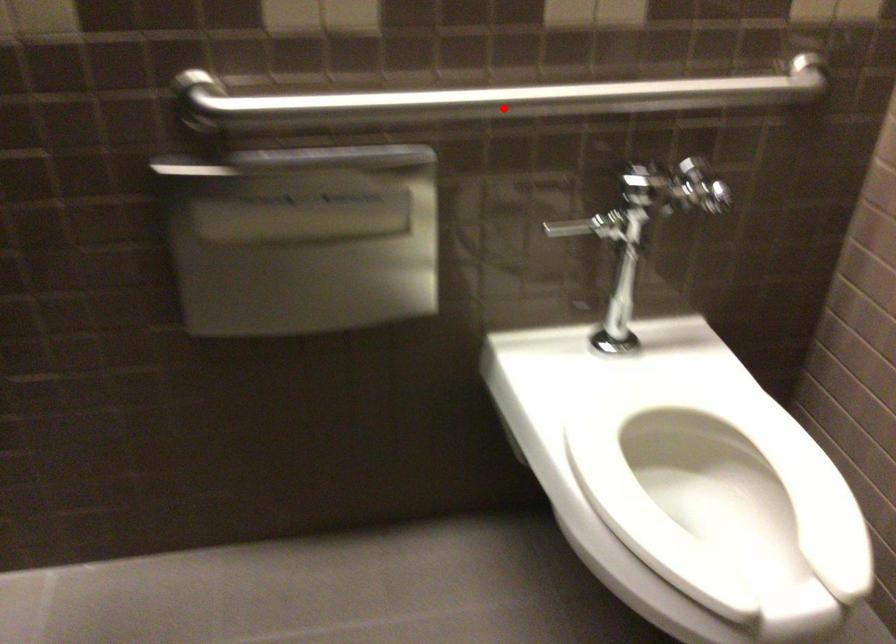
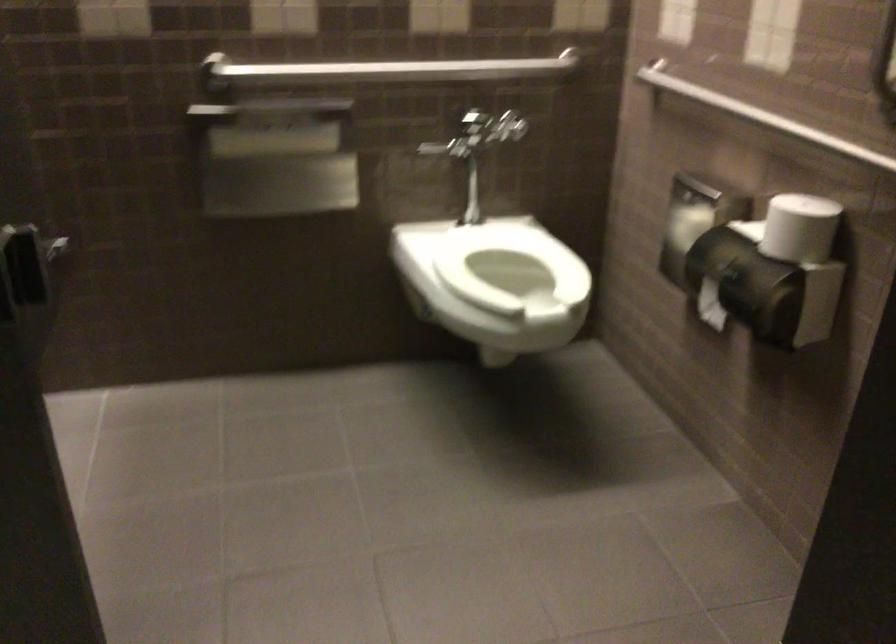
Where in the second image is the point corresponding to the highlighted location from the first image?

(391, 69)